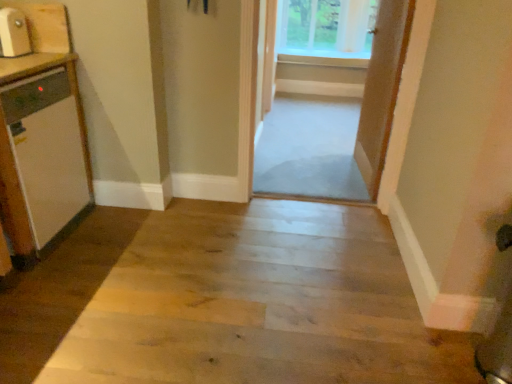
Question: From the image's perspective, relative to clear glass screen door at center, is matte wood microwave at left, which appears as the 2th appliance when ordered from the bottom, above or below?

Choices:
 (A) below
 (B) above

Answer: (B)

Question: Looking at the image, does matte wood microwave at left, which appears as the 2th appliance when ordered from the bottom, seem bigger or smaller compared to clear glass screen door at center?

Choices:
 (A) big
 (B) small

Answer: (B)

Question: Estimate the real-world distances between objects in this image. Which object is farther from the matte wood microwave at left, marked as the 1th appliance in a top-to-bottom arrangement?

Choices:
 (A) clear glass screen door at center
 (B) white glossy dishwasher at left, which is the second appliance from top to bottom
 (C) clear glass window at upper center
 (D) wooden floor at center
 (E) wooden door at center, which appears as the first door when viewed from the back

Answer: (C)

Question: Considering the real-world distances, which object is farthest from the wooden door at center, which is counted as the second door, starting from the back?

Choices:
 (A) matte wood microwave at left, which appears as the 2th appliance when ordered from the bottom
 (B) clear glass window at upper center
 (C) wooden door at center, which is the 1th door in left-to-right order
 (D) wooden floor at center
 (E) clear glass screen door at center

Answer: (A)